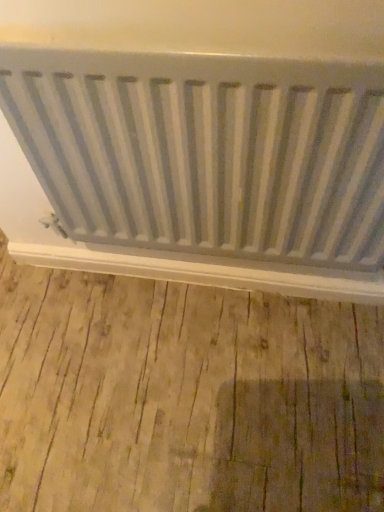
Question: From a real-world perspective, is white matte radiator at lower center positioned above or below white matte radiator at center?

Choices:
 (A) above
 (B) below

Answer: (B)

Question: Is white matte radiator at lower center wider or thinner than white matte radiator at center?

Choices:
 (A) wide
 (B) thin

Answer: (B)

Question: Based on their positions, is white matte radiator at lower center located to the left or right of white matte radiator at center?

Choices:
 (A) right
 (B) left

Answer: (B)

Question: Looking at their shapes, would you say white matte radiator at center is wider or thinner than white matte radiator at lower center?

Choices:
 (A) thin
 (B) wide

Answer: (B)

Question: In terms of size, does white matte radiator at center appear bigger or smaller than white matte radiator at lower center?

Choices:
 (A) small
 (B) big

Answer: (B)

Question: From a real-world perspective, is white matte radiator at center physically located above or below white matte radiator at lower center?

Choices:
 (A) below
 (B) above

Answer: (B)

Question: Is point click(x=301, y=133) closer or farther from the camera than point click(x=233, y=284)?

Choices:
 (A) farther
 (B) closer

Answer: (B)